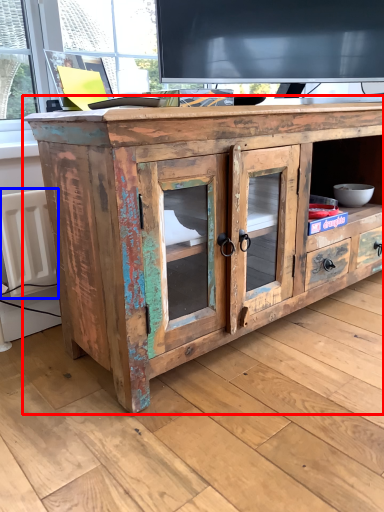
Question: Which object appears farthest to the camera in this image, chest of drawers (highlighted by a red box) or radiator (highlighted by a blue box)?

Choices:
 (A) chest of drawers
 (B) radiator

Answer: (B)